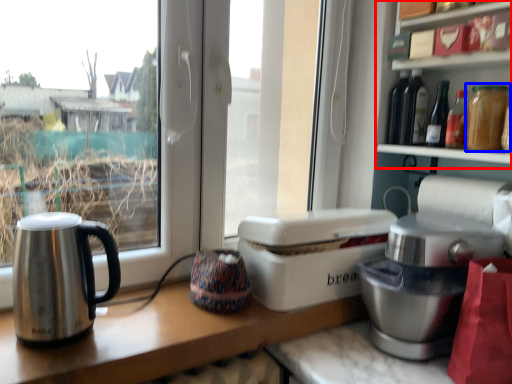
Question: Which object appears farthest to the camera in this image, shelf (highlighted by a red box) or bottle (highlighted by a blue box)?

Choices:
 (A) shelf
 (B) bottle

Answer: (B)